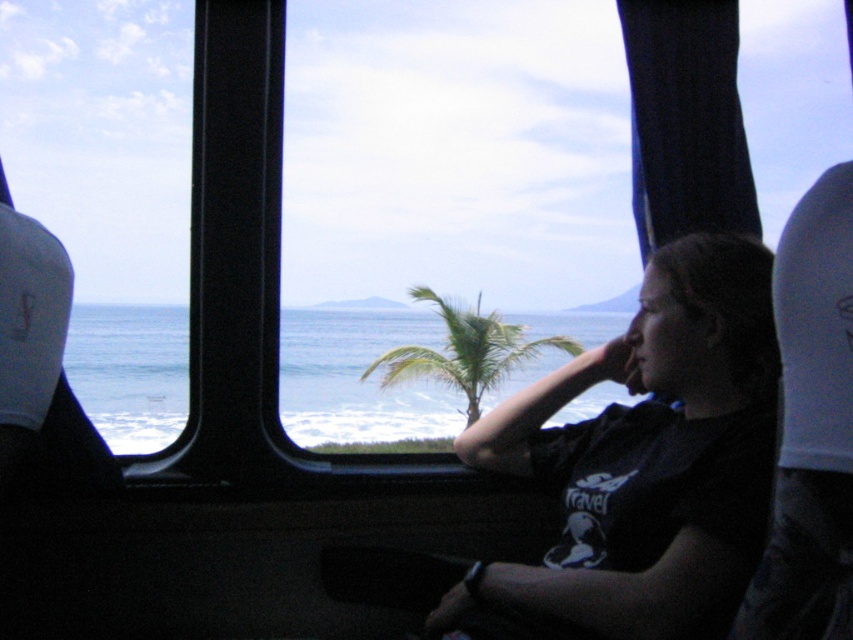
Question: Which point is closer to the camera taking this photo?

Choices:
 (A) (497, 316)
 (B) (642, 332)
 (C) (178, 97)
 (D) (293, 83)

Answer: (B)

Question: From the image, what is the correct spatial relationship of transparent glass window at center in relation to green leafy palm tree at center?

Choices:
 (A) left
 (B) right

Answer: (A)

Question: Which point is farther to the camera?

Choices:
 (A) (370, 365)
 (B) (506, 448)
 (C) (608, 288)

Answer: (A)

Question: Which object appears closest to the camera in this image?

Choices:
 (A) transparent glass window at left
 (B) green leafy palm tree at center
 (C) transparent glass window at center

Answer: (A)

Question: Does transparent glass window at left have a larger size compared to green leafy palm tree at center?

Choices:
 (A) yes
 (B) no

Answer: (A)

Question: Does transparent glass window at center appear on the right side of transparent glass window at left?

Choices:
 (A) yes
 (B) no

Answer: (A)